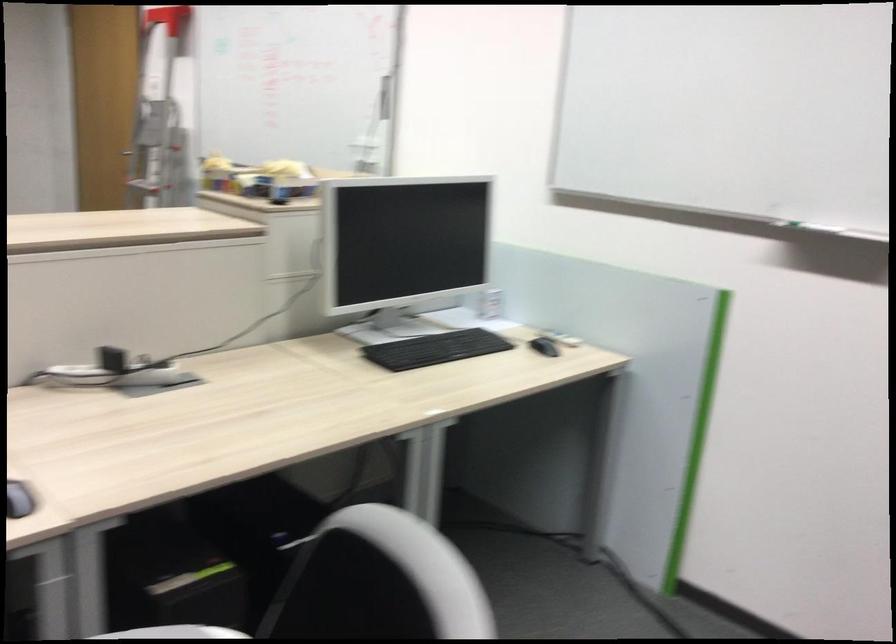
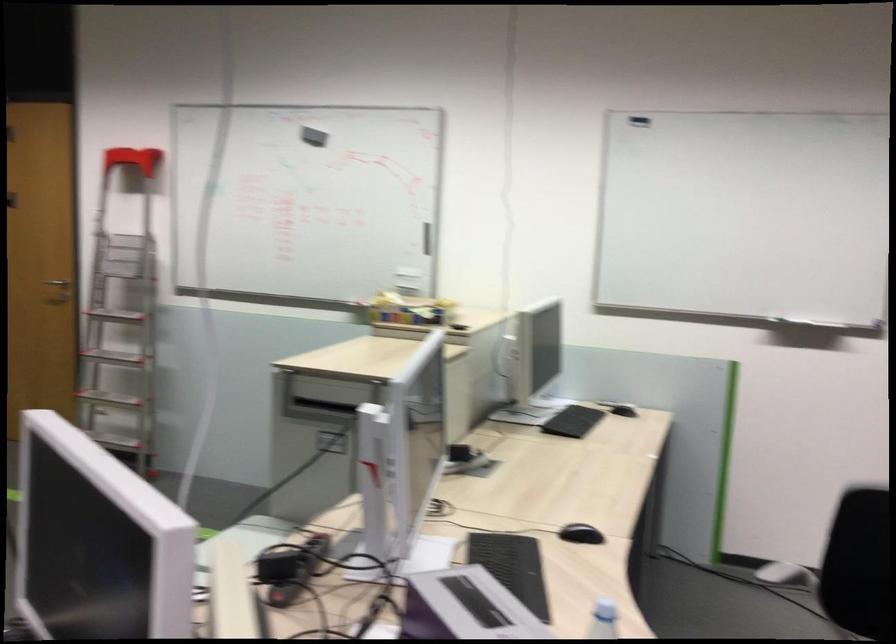
Question: The images are taken continuously from a first-person perspective. In which direction are you moving?

Choices:
 (A) Left
 (B) Right
 (C) Forward
 (D) Backward

Answer: (A)